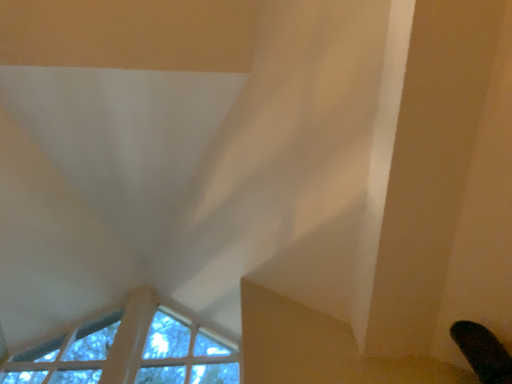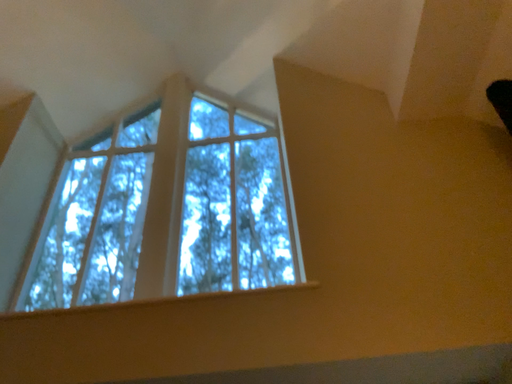
Question: How did the camera likely rotate when shooting the video?

Choices:
 (A) rotated upward
 (B) rotated downward

Answer: (B)